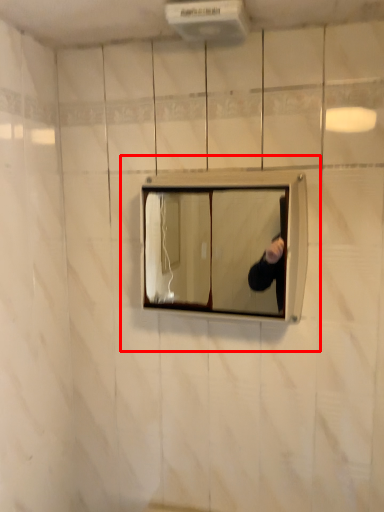
Question: In this image, where is medicine cabinet (annotated by the red box) located relative to air conditioner?

Choices:
 (A) left
 (B) right

Answer: (B)